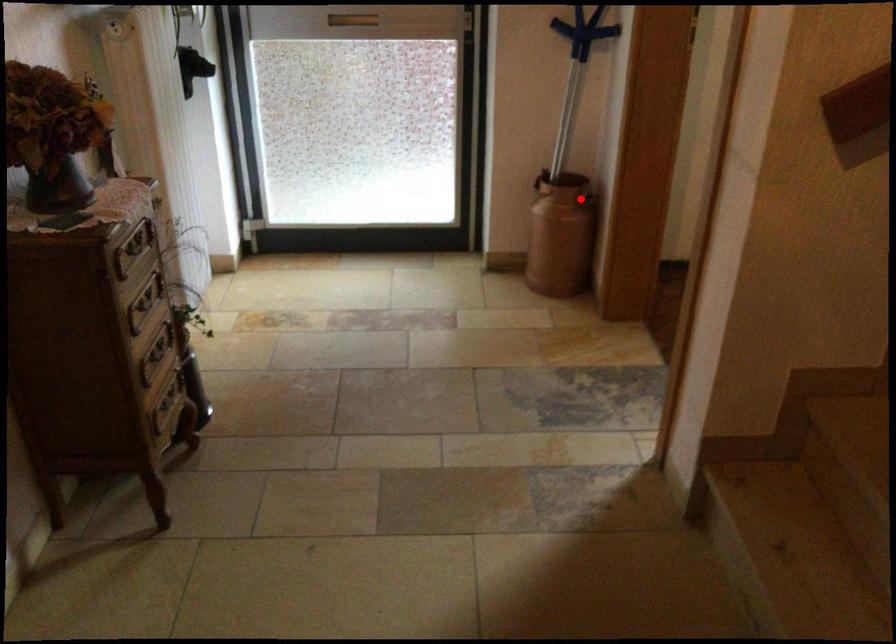
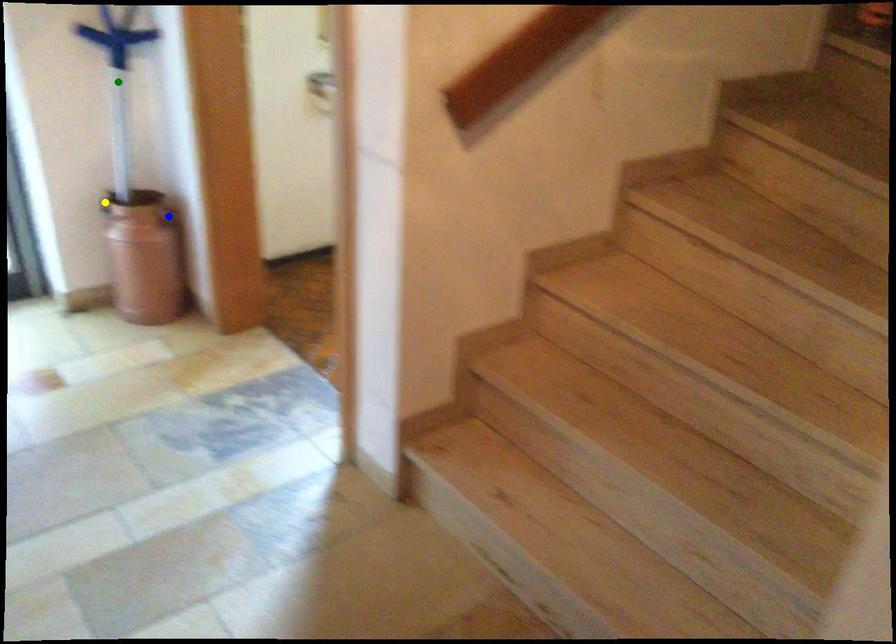
Question: I am providing you with two images of the same scene from different viewpoints. A red point is marked on the first image. You are given multiple points on the second image. In image 2, which mark is for the same physical point as the one in image 1?

Choices:
 (A) green point
 (B) yellow point
 (C) blue point

Answer: (C)